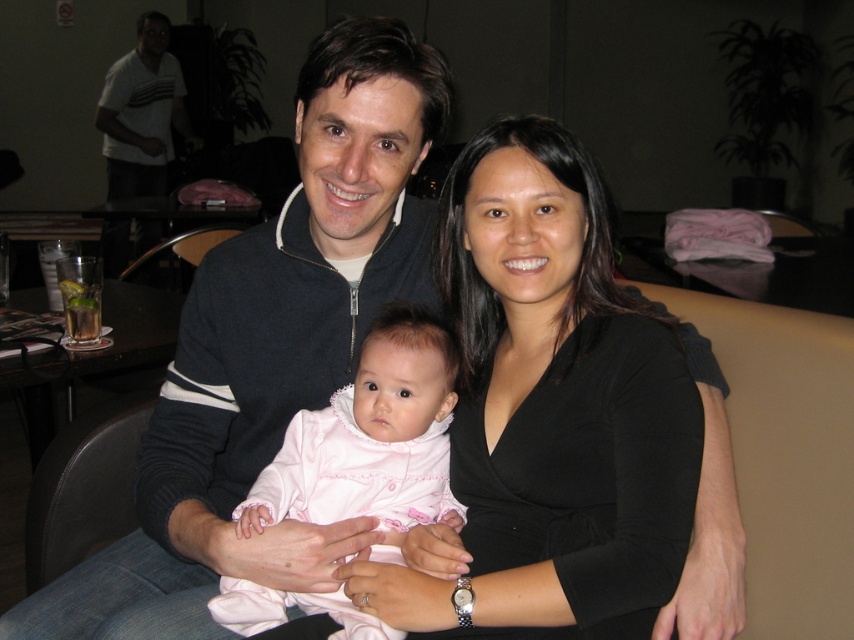
You are a photographer trying to capture a candid shot of the black matte shirt at center and the pink soft fabric baby at center. If your camera has a depth of field that can focus on objects within 5 inches, will both subjects be in focus?

The black matte shirt at center is 5.04 inches away from the pink soft fabric baby at center. Since the distance between them is slightly over 5 inches, the camera might struggle to keep both in focus simultaneously due to the limited depth of field.

From the picture: You are a photographer trying to adjust the lighting for a portrait. The subject is wearing a black matte shirt at center. Where exactly should you position the key light to ensure it illuminates the subject effectively?

The key light should be positioned opposite the black matte shirt at center to ensure proper illumination, considering its location at point [551,410].